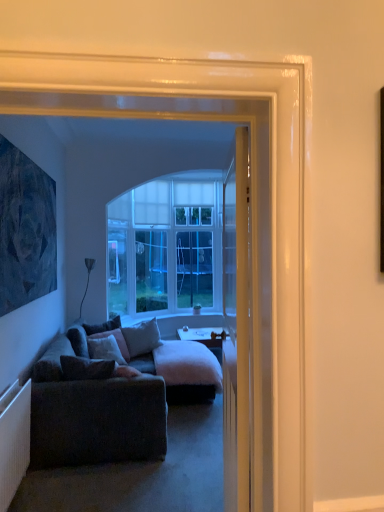
This screenshot has height=512, width=384. Describe the element at coordinates (203, 336) in the screenshot. I see `smooth wooden desk at center` at that location.

The width and height of the screenshot is (384, 512). Describe the element at coordinates (102, 326) in the screenshot. I see `velvet gray pillow at center, which appears as the fourth pillow when viewed from the front` at that location.

Describe the element at coordinates (141, 337) in the screenshot. I see `gray fabric pillow at center, which is the second pillow from back to front` at that location.

Image resolution: width=384 pixels, height=512 pixels. What are the coordinates of `smooth wooden desk at center` in the screenshot? It's located at (203, 336).

Is there a large distance between velvet gray pillow at center, marked as the 3th pillow in a back-to-front arrangement, and white glossy door at center?

velvet gray pillow at center, marked as the 3th pillow in a back-to-front arrangement, is positioned a significant distance from white glossy door at center.

Does velvet gray pillow at center, the 2th pillow from the front, have a greater height compared to white glossy door at center?

No, velvet gray pillow at center, the 2th pillow from the front, is not taller than white glossy door at center.

How different are the orientations of velvet gray pillow at center, marked as the 3th pillow in a back-to-front arrangement, and white glossy door at center in degrees?

The angular difference between velvet gray pillow at center, marked as the 3th pillow in a back-to-front arrangement, and white glossy door at center is 146 degrees.

Between velvet gray pillow at center, the 2th pillow from the front, and white glossy door at center, which one appears on the right side from the viewer's perspective?

white glossy door at center.

Based on the photo, measure the distance from smooth wooden desk at center to white glossy door at center.

3.62 meters.

Looking at their sizes, would you say smooth wooden desk at center is wider or thinner than white glossy door at center?

Clearly, smooth wooden desk at center has more width compared to white glossy door at center.

Is smooth wooden desk at center positioned with its back to white glossy door at center?

No, smooth wooden desk at center is not facing the opposite direction of white glossy door at center.

Considering the relative sizes of smooth wooden desk at center and white glossy door at center in the image provided, is smooth wooden desk at center taller than white glossy door at center?

In fact, smooth wooden desk at center may be shorter than white glossy door at center.

Does point (13, 274) lie in front of point (155, 321)?

Yes, it is in front of point (155, 321).

Considering the relative sizes of dark blue textured painting at left and gray fabric pillow at center, which is the second pillow from back to front, in the image provided, is dark blue textured painting at left shorter than gray fabric pillow at center, which is the second pillow from back to front,?

In fact, dark blue textured painting at left may be taller than gray fabric pillow at center, which is the second pillow from back to front.

Looking at their sizes, would you say dark blue textured painting at left is wider or thinner than gray fabric pillow at center, the 3th pillow from the front?

In the image, dark blue textured painting at left appears to be more narrow than gray fabric pillow at center, the 3th pillow from the front.

Is there a large distance between dark blue textured painting at left and gray fabric pillow at center, which is the second pillow from back to front?

dark blue textured painting at left is positioned a significant distance from gray fabric pillow at center, which is the second pillow from back to front.

From a real-world perspective, is white glossy door at center above or below dark gray fabric couch at lower left?

In terms of real-world spatial position, white glossy door at center is above dark gray fabric couch at lower left.

Considering the relative sizes of white glossy door at center and dark gray fabric couch at lower left in the image provided, is white glossy door at center shorter than dark gray fabric couch at lower left?

No, white glossy door at center is not shorter than dark gray fabric couch at lower left.

Can you confirm if white glossy door at center is positioned to the left of dark gray fabric couch at lower left?

Incorrect, white glossy door at center is not on the left side of dark gray fabric couch at lower left.

Which of these two, clear glass door at center or white textured radiator at lower left, is bigger?

With larger size is clear glass door at center.

In the scene shown: From a real-world perspective, is clear glass door at center on top of white textured radiator at lower left?

Yes, from a real-world perspective, clear glass door at center is on top of white textured radiator at lower left.

Is clear glass door at center not near white textured radiator at lower left?

That's right, there is a large distance between clear glass door at center and white textured radiator at lower left.

Is dark gray fabric couch at lower left far from smooth wooden desk at center?

Yes, dark gray fabric couch at lower left and smooth wooden desk at center are located far from each other.

Does point (94, 460) appear closer or farther from the camera than point (220, 332)?

Point (94, 460) is closer to the camera than point (220, 332).

In the scene shown: Is dark gray fabric couch at lower left shorter than smooth wooden desk at center?

No.

Can you confirm if dark gray fabric couch at lower left is positioned to the left of smooth wooden desk at center?

Correct, you'll find dark gray fabric couch at lower left to the left of smooth wooden desk at center.

From the image's perspective, which one is positioned lower, white fluffy blanket at center or velvet brown pillow at center, which is counted as the first pillow, starting from the front?

white fluffy blanket at center appears lower in the image.

Is white fluffy blanket at center not close to velvet brown pillow at center, the 4th pillow positioned from the back?

Indeed, white fluffy blanket at center is not near velvet brown pillow at center, the 4th pillow positioned from the back.

Is velvet brown pillow at center, the 4th pillow positioned from the back, at the back of white fluffy blanket at center?

white fluffy blanket at center is not turned away from velvet brown pillow at center, the 4th pillow positioned from the back.

You are a GUI agent. You are given a task and a screenshot of the screen. Output one action in this format:
    pyautogui.click(x=<x>, y=<y>)
    Task: Click on the 2nd pillow behind the white glossy door at center, counting from the anchor's position
    The image size is (384, 512).
    Given the screenshot: What is the action you would take?
    pyautogui.click(x=106, y=349)

This screenshot has height=512, width=384. What are the coordinates of `door positioned vertically above the smooth wooden desk at center (from a real-world perspective)` in the screenshot? It's located at coord(236,329).

Based on their spatial positions, is smooth wooden desk at center or clear glass door at center closer to dark gray fabric couch at lower left?

Based on the image, smooth wooden desk at center appears to be nearer to dark gray fabric couch at lower left.

Which object lies further to the anchor point smooth wooden desk at center, clear glass door at center or white textured radiator at lower left?

The object further to smooth wooden desk at center is white textured radiator at lower left.

Which object lies nearer to the anchor point dark gray fabric couch at lower left, white textured radiator at lower left or dark blue textured painting at left?

white textured radiator at lower left is positioned closer to the anchor dark gray fabric couch at lower left.

Which object lies nearer to the anchor point velvet gray pillow at center, which appears as the fourth pillow when viewed from the front, dark gray fabric couch at lower left or white textured radiator at lower left?

Based on the image, dark gray fabric couch at lower left appears to be nearer to velvet gray pillow at center, which appears as the fourth pillow when viewed from the front.

When comparing their distances from clear glass door at center, does white fluffy blanket at center or velvet brown pillow at center, the 4th pillow positioned from the back, seem closer?

white fluffy blanket at center.

Considering their positions, is dark gray fabric couch at lower left positioned closer to smooth wooden desk at center than gray fabric pillow at center, the 3th pillow from the front?

Among the two, gray fabric pillow at center, the 3th pillow from the front, is located nearer to smooth wooden desk at center.

Based on their spatial positions, is clear glass door at center or smooth wooden desk at center closer to white glossy door at center?

smooth wooden desk at center lies closer to white glossy door at center than the other object.

In the scene shown: Which object lies further to the anchor point dark blue textured painting at left, gray fabric pillow at center, the 3th pillow from the front, or velvet gray pillow at center, acting as the 1th pillow starting from the back?

gray fabric pillow at center, the 3th pillow from the front, lies further to dark blue textured painting at left than the other object.

Find the location of a particular element. picture frame between white textured radiator at lower left and white fluffy blanket at center in the front-back direction is located at coordinates (25, 230).

Find the location of `studio couch between dark blue textured painting at left and gray fabric pillow at center, the 3th pillow from the front, along the z-axis`. studio couch between dark blue textured painting at left and gray fabric pillow at center, the 3th pillow from the front, along the z-axis is located at coordinates (113, 402).

Where is `bedding located between white glossy door at center and clear glass door at center in the depth direction`? The image size is (384, 512). bedding located between white glossy door at center and clear glass door at center in the depth direction is located at coordinates (188, 372).

The image size is (384, 512). In order to click on picture frame positioned between white glossy door at center and white fluffy blanket at center from near to far in this screenshot , I will do coord(25,230).